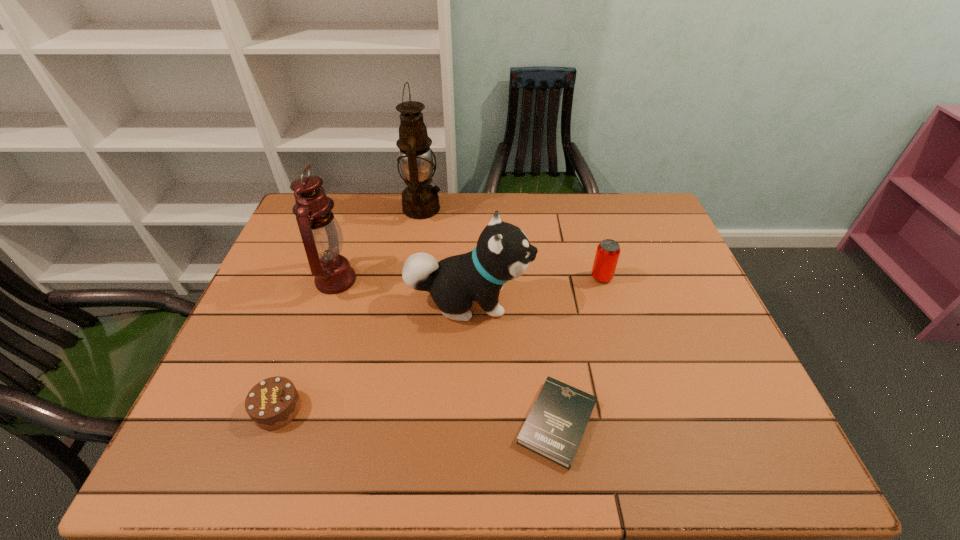
At what (x,y) coordinates should I click in order to perform the action: click on the farthest object. Please return your answer as a coordinate pair (x, y). Image resolution: width=960 pixels, height=540 pixels. Looking at the image, I should click on (420, 200).

I want to click on the farther oil lamp, so click(x=420, y=200).

This screenshot has width=960, height=540. In order to click on the fifth shortest object in this screenshot , I will do `click(322, 237)`.

Find the location of `the shorter oil lamp`. the shorter oil lamp is located at coordinates (322, 237).

The width and height of the screenshot is (960, 540). Find the location of `the fourth shortest object`. the fourth shortest object is located at coordinates (503, 252).

I want to click on the rightmost object, so click(x=607, y=254).

At what (x,y) coordinates should I click in order to perform the action: click on the third shortest object. Please return your answer as a coordinate pair (x, y). The image size is (960, 540). Looking at the image, I should click on (x=607, y=254).

Locate an element on the screen. This screenshot has height=540, width=960. the fifth tallest object is located at coordinates (274, 402).

This screenshot has width=960, height=540. What are the coordinates of `book` in the screenshot? It's located at (554, 428).

Identify the location of vacant space located 0.260m on the front of the farthest object. (410, 281).